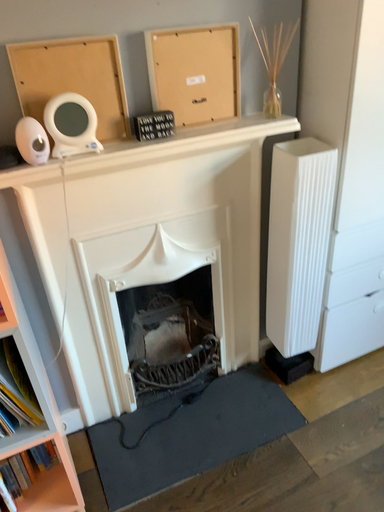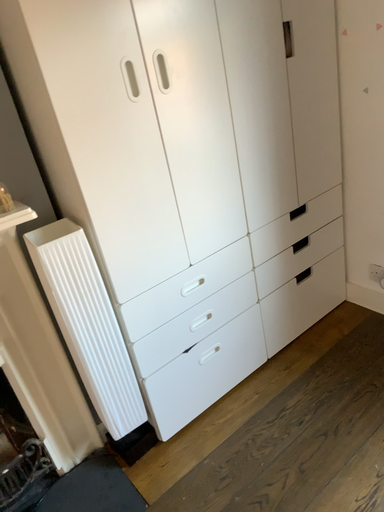
Question: How did the camera likely rotate when shooting the video?

Choices:
 (A) rotated right
 (B) rotated left

Answer: (A)